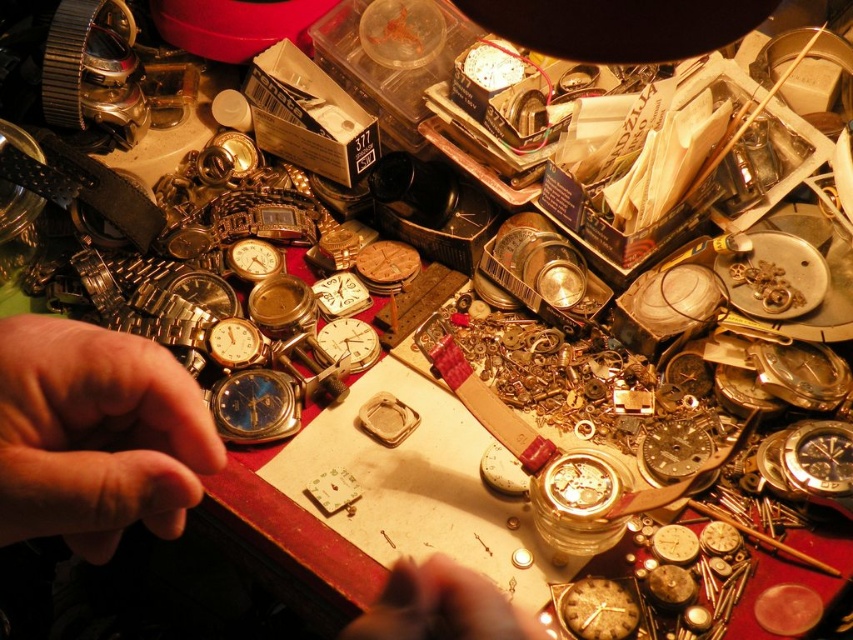
Does point (456, 634) lie behind point (578, 605)?

No, it is in front of (578, 605).

Is point (410, 561) behind point (569, 605)?

Yes, point (410, 561) is farther from viewer.

Find the location of a particular element. flesh-toned skin at center is located at coordinates (440, 605).

Who is higher up, flesh-toned skin at center or matte silver watch at center?

matte silver watch at center is above.

Is flesh-toned skin at center to the right of matte silver watch at center from the viewer's perspective?

Yes, flesh-toned skin at center is to the right of matte silver watch at center.

Who is more forward, (479,598) or (354,333)?

Point (479,598) is more forward.

At what (x,y) coordinates should I click in order to perform the action: click on flesh-toned skin at center. Please return your answer as a coordinate pair (x, y). The width and height of the screenshot is (853, 640). Looking at the image, I should click on (440, 605).

Is point (503, 627) less distant than point (33, 467)?

No, (503, 627) is behind (33, 467).

Can you confirm if metallic watch at center is positioned to the left of skinny gold watch at left?

Yes, metallic watch at center is to the left of skinny gold watch at left.

Identify the location of metallic watch at center. The image size is (853, 640). (96, 435).

Image resolution: width=853 pixels, height=640 pixels. What are the coordinates of `metallic watch at center` in the screenshot? It's located at (96, 435).